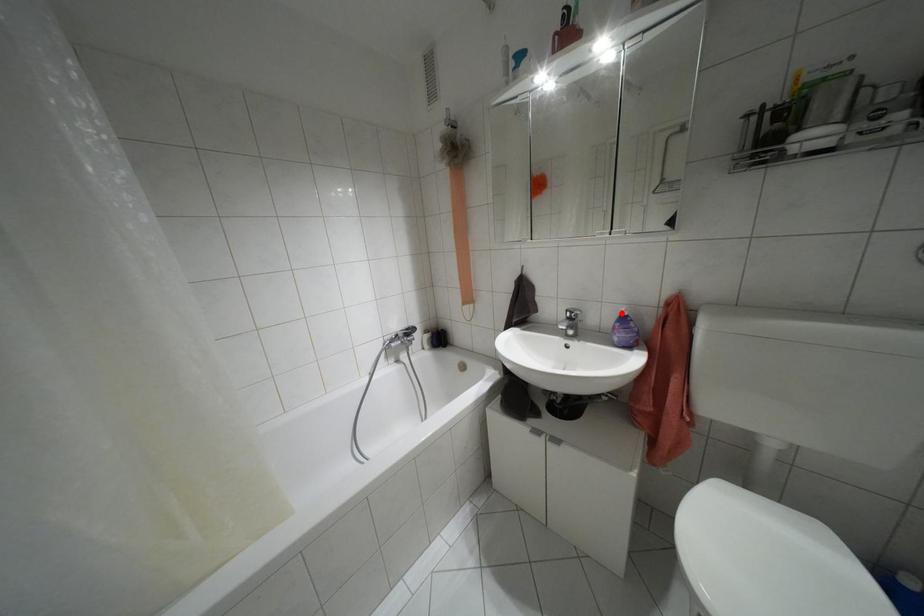
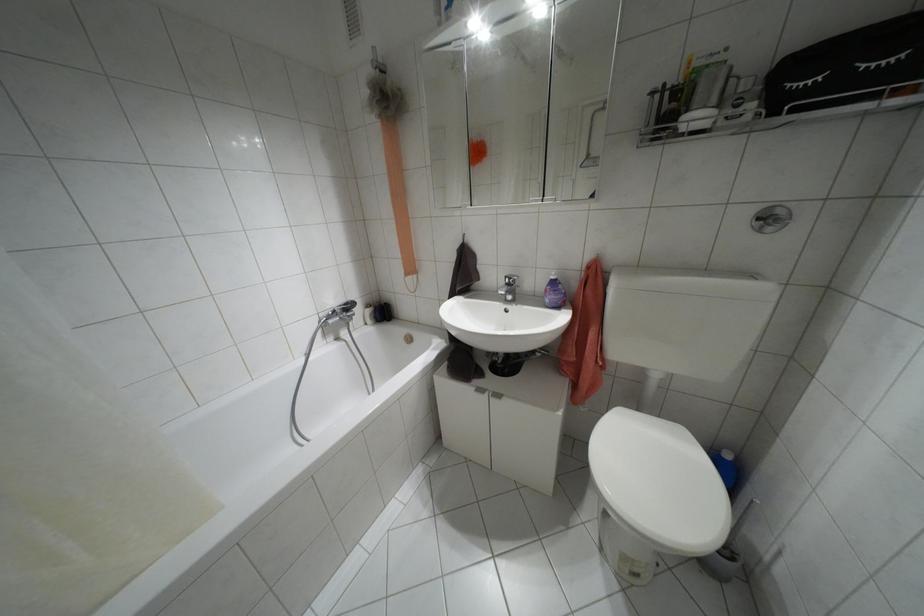
In the second image, find the point that corresponds to the highlighted location in the first image.

(552, 277)